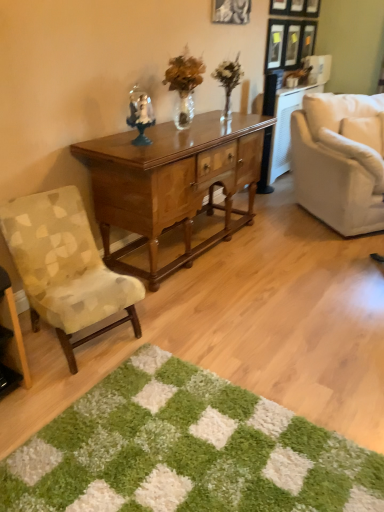
Locate an element on the screen. The width and height of the screenshot is (384, 512). free area behind green shaggy rug at lower center is located at coordinates (243, 333).